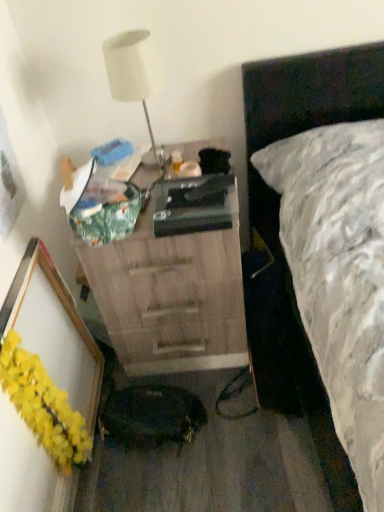
Question: Should I look upward or downward to see white matte lamp at upper left?

Choices:
 (A) up
 (B) down

Answer: (A)

Question: Can you confirm if wooden chest of drawers at center is smaller than white matte lamp at upper left?

Choices:
 (A) no
 (B) yes

Answer: (A)

Question: Are wooden chest of drawers at center and white matte lamp at upper left beside each other?

Choices:
 (A) yes
 (B) no

Answer: (B)

Question: From the image's perspective, is wooden chest of drawers at center beneath white matte lamp at upper left?

Choices:
 (A) yes
 (B) no

Answer: (A)

Question: Is wooden chest of drawers at center at the left side of white matte lamp at upper left?

Choices:
 (A) no
 (B) yes

Answer: (A)

Question: Is wooden chest of drawers at center further to camera compared to white matte lamp at upper left?

Choices:
 (A) yes
 (B) no

Answer: (B)

Question: Would you say wooden chest of drawers at center is outside white matte lamp at upper left?

Choices:
 (A) no
 (B) yes

Answer: (B)

Question: Is wooden chest of drawers at center inside white matte lamp at upper left?

Choices:
 (A) yes
 (B) no

Answer: (B)

Question: Is white matte lamp at upper left oriented towards wooden chest of drawers at center?

Choices:
 (A) yes
 (B) no

Answer: (B)

Question: Considering the relative positions of white matte lamp at upper left and wooden chest of drawers at center in the image provided, is white matte lamp at upper left to the left of wooden chest of drawers at center from the viewer's perspective?

Choices:
 (A) yes
 (B) no

Answer: (A)

Question: From a real-world perspective, is white matte lamp at upper left physically above wooden chest of drawers at center?

Choices:
 (A) yes
 (B) no

Answer: (A)

Question: Considering the relative positions of white matte lamp at upper left and wooden chest of drawers at center in the image provided, is white matte lamp at upper left behind wooden chest of drawers at center?

Choices:
 (A) no
 (B) yes

Answer: (B)

Question: Is white matte lamp at upper left looking in the opposite direction of wooden chest of drawers at center?

Choices:
 (A) no
 (B) yes

Answer: (A)

Question: From a real-world perspective, is yellow fluffy garland at lower left located higher than wooden chest of drawers at center?

Choices:
 (A) yes
 (B) no

Answer: (A)